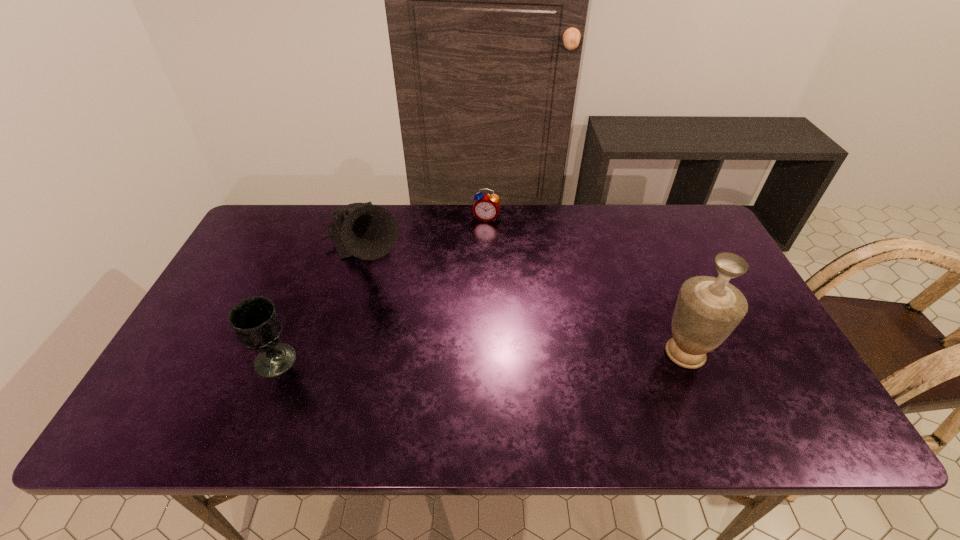
The width and height of the screenshot is (960, 540). In order to click on free space that satisfies the following two spatial constraints: 1. on the front side of the urn; 2. on the left side of the third object from left to right in this screenshot , I will do `click(489, 354)`.